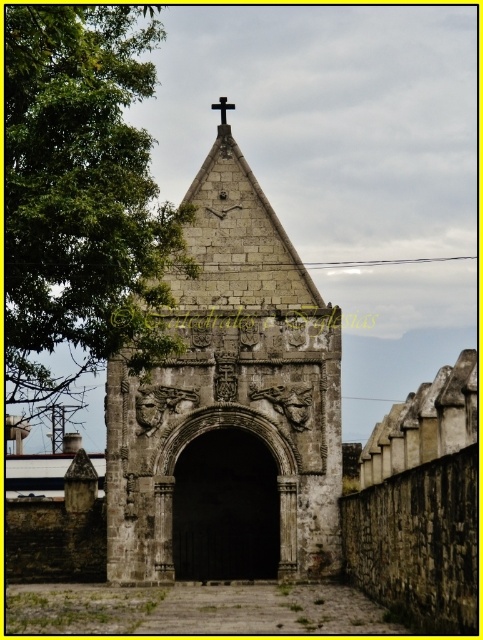
Question: Observing the image, what is the correct spatial positioning of green leafy tree at left in reference to black stone cross at top?

Choices:
 (A) left
 (B) right

Answer: (A)

Question: Which point appears farthest from the camera in this image?

Choices:
 (A) (297, 534)
 (B) (105, 211)
 (C) (213, 108)

Answer: (C)

Question: Estimate the real-world distances between objects in this image. Which object is farther from the green leafy tree at left?

Choices:
 (A) gray stone church at center
 (B) black stone cross at top

Answer: (B)

Question: Which of the following is the farthest from the observer?

Choices:
 (A) green leafy tree at left
 (B) black stone cross at top

Answer: (B)

Question: Is gray stone church at center positioned in front of green leafy tree at left?

Choices:
 (A) no
 (B) yes

Answer: (A)

Question: Is gray stone church at center above black stone cross at top?

Choices:
 (A) no
 (B) yes

Answer: (A)